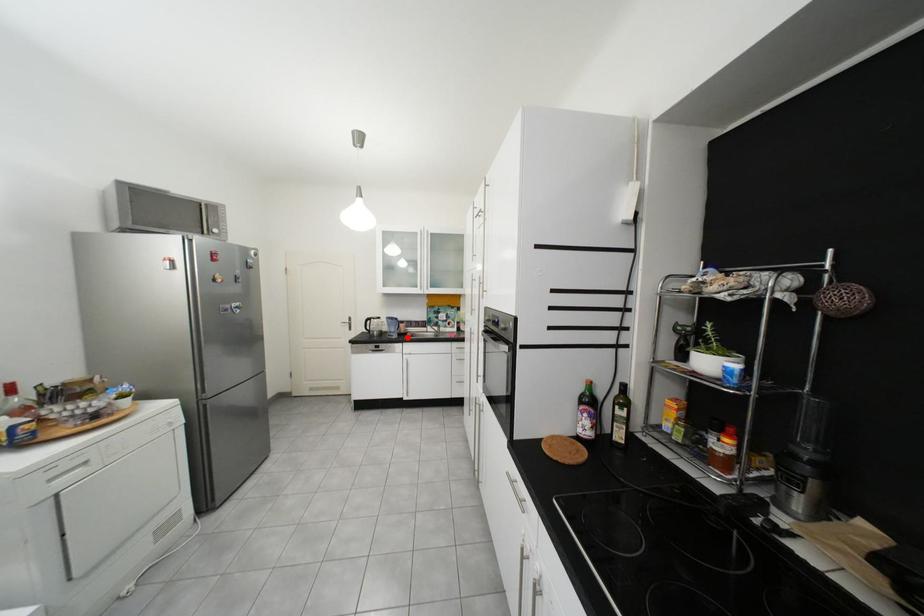
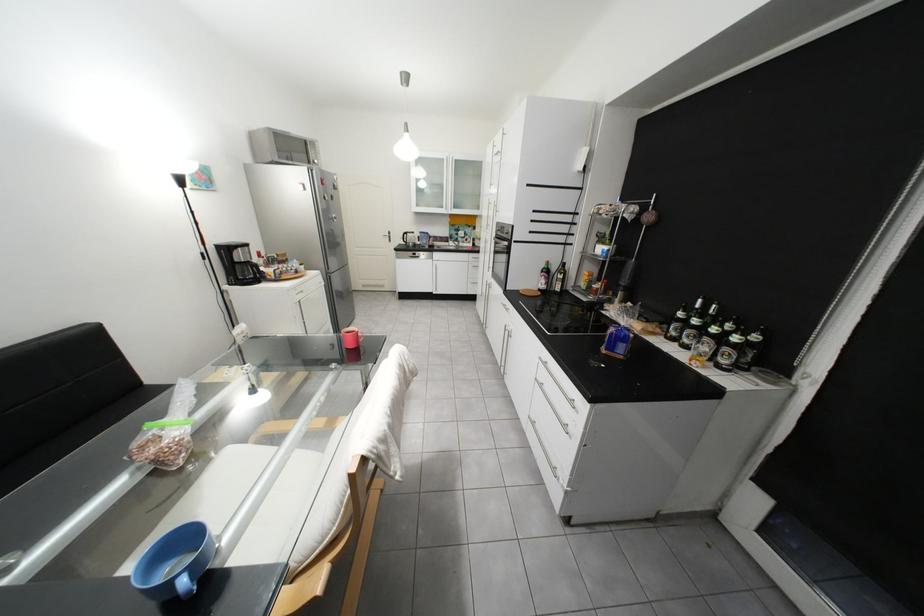
Question: I am providing you with two images of the same scene from different viewpoints. A red point is shown in image1. For the corresponding object point in image2, is it positioned nearer or farther from the camera?

Choices:
 (A) Nearer
 (B) Farther

Answer: (A)